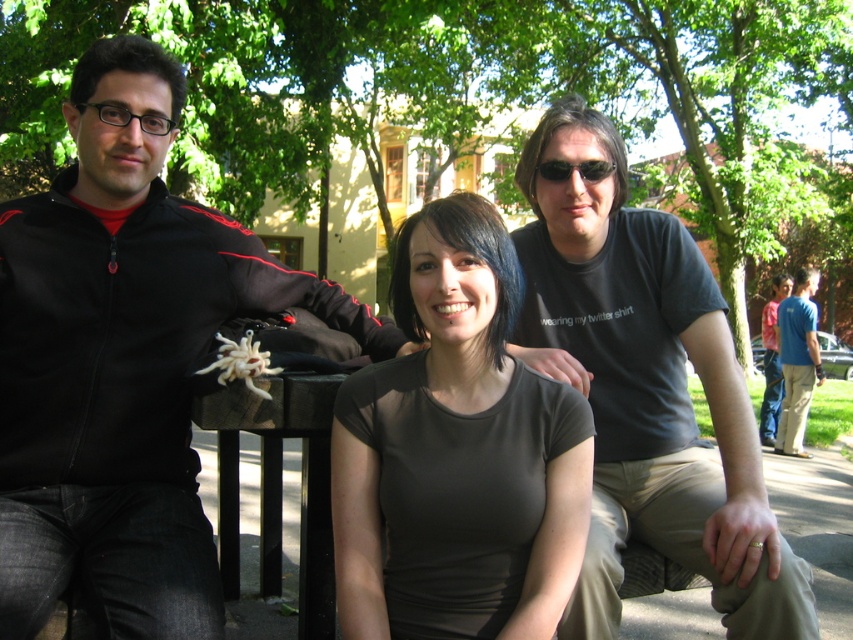
Based on the scene description, can you determine the spatial relationship between the black matte jacket at left and the blue cotton shirt at lower right?

The black matte jacket at left is located to the left of the blue cotton shirt at lower right.

You are standing at the point with coordinates point (788, 454) and want to move to the point (294, 278). Which direction should you move to reach your destination?

You should move forward because point (294, 278) is in front of point (788, 454).